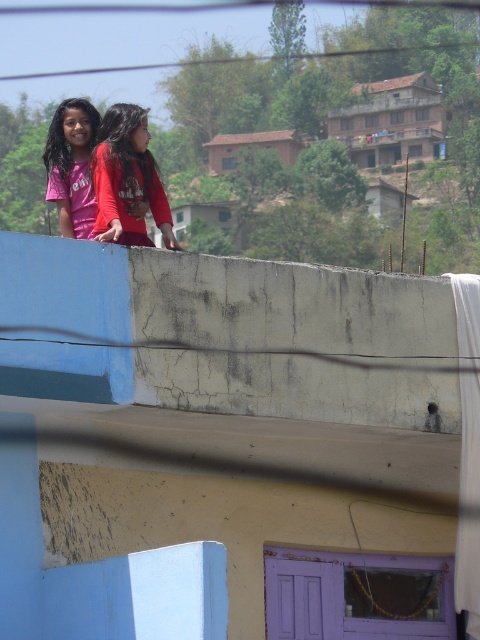
What do you see at coordinates (127, 179) in the screenshot? The image size is (480, 640). I see `matte red shirt at upper left` at bounding box center [127, 179].

Where is `matte red shirt at upper left`? This screenshot has width=480, height=640. matte red shirt at upper left is located at coordinates (127, 179).

At what (x,y) coordinates should I click in order to perform the action: click on matte red shirt at upper left. Please return your answer as a coordinate pair (x, y). Looking at the image, I should click on (127, 179).